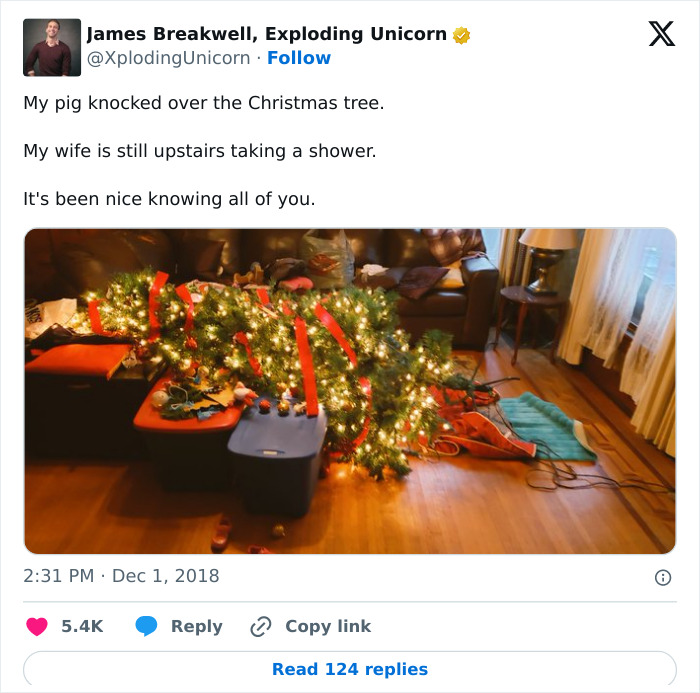
The height and width of the screenshot is (693, 700). Find the location of `couch`. couch is located at coordinates (451, 296), (140, 263).